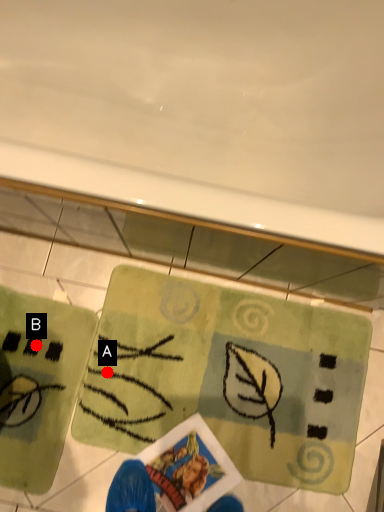
Question: Two points are circled on the image, labeled by A and B beside each circle. Which point is farther to the camera?

Choices:
 (A) A is further
 (B) B is further

Answer: (B)